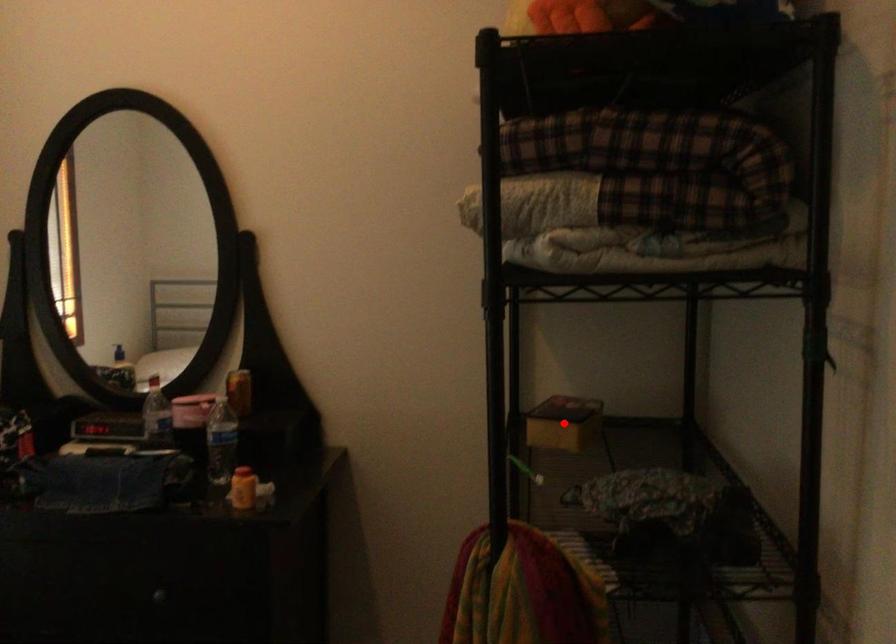
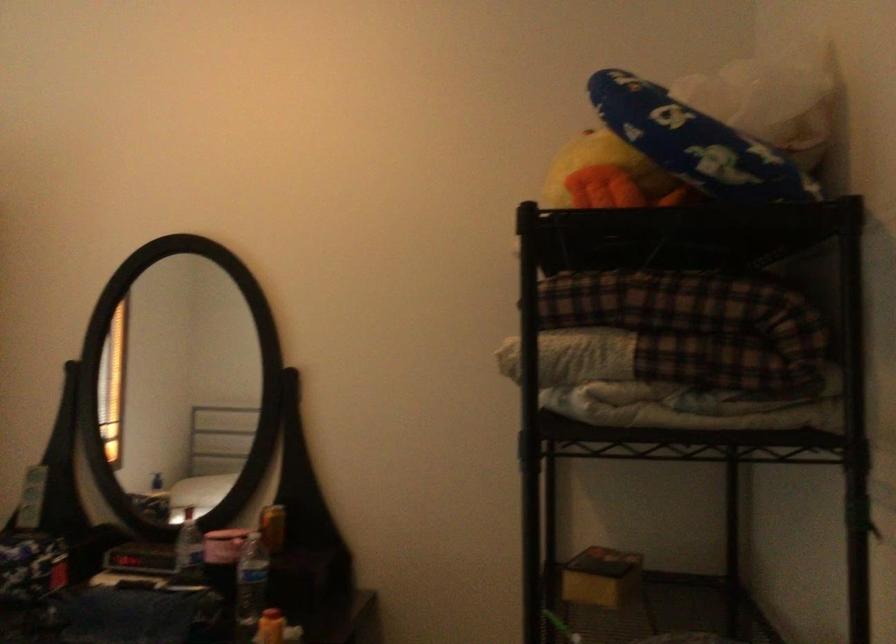
The point at the highlighted location is marked in the first image. Where is the corresponding point in the second image?

(600, 576)